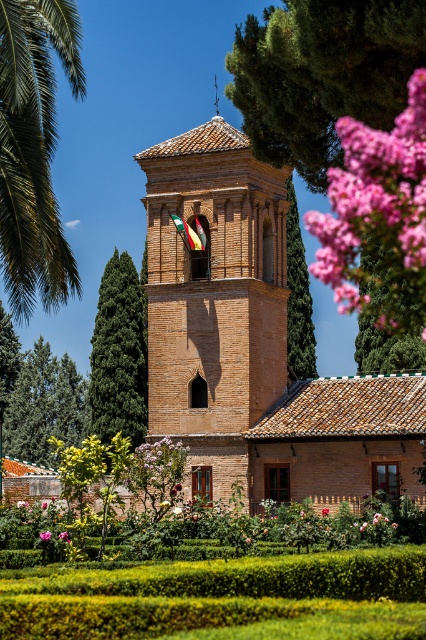
Does pink silky petals at upper right have a greater width compared to green textured tree at center?

Yes, pink silky petals at upper right is wider than green textured tree at center.

Does point (342, 120) come farther from viewer compared to point (101, 276)?

No, it is not.

What do you see at coordinates (377, 212) in the screenshot? I see `pink silky petals at upper right` at bounding box center [377, 212].

Find the location of `pink silky petals at upper right`. pink silky petals at upper right is located at coordinates (377, 212).

Can you confirm if green leafy palm at upper left is wider than pink matte flower at center?

Indeed, green leafy palm at upper left has a greater width compared to pink matte flower at center.

Is point (5, 202) more distant than point (325, 508)?

No, it is in front of (325, 508).

Which is in front, point (25, 225) or point (322, 508)?

Positioned in front is point (25, 225).

At what (x,y) coordinates should I click in order to perform the action: click on green leafy palm at upper left. Please return your answer as a coordinate pair (x, y). This screenshot has height=640, width=426. Looking at the image, I should click on (34, 148).

From the picture: Is green leafy tree at upper right wider than pink matte flower at upper right?

Yes, green leafy tree at upper right is wider than pink matte flower at upper right.

Who is positioned more to the right, green leafy tree at upper right or pink matte flower at upper right?

Positioned to the right is green leafy tree at upper right.

Describe the element at coordinates (322, 74) in the screenshot. Image resolution: width=426 pixels, height=640 pixels. I see `green leafy tree at upper right` at that location.

You are a GUI agent. You are given a task and a screenshot of the screen. Output one action in this format:
    pyautogui.click(x=<x>, y=<y>)
    Task: Click on the green leafy tree at upper right
    
    Given the screenshot: What is the action you would take?
    pyautogui.click(x=322, y=74)